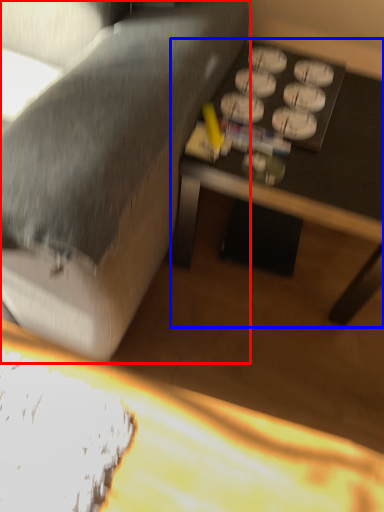
Question: Which point is further to the camera, studio couch (highlighted by a red box) or table (highlighted by a blue box)?

Choices:
 (A) studio couch
 (B) table

Answer: (B)